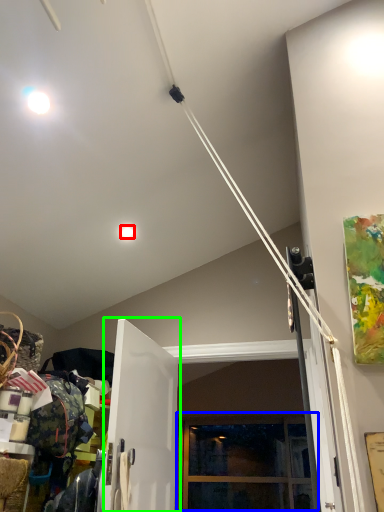
Question: Considering the real-world distances, which object is closest to droplight (highlighted by a red box)? window (highlighted by a blue box) or door (highlighted by a green box).

Choices:
 (A) window
 (B) door

Answer: (B)